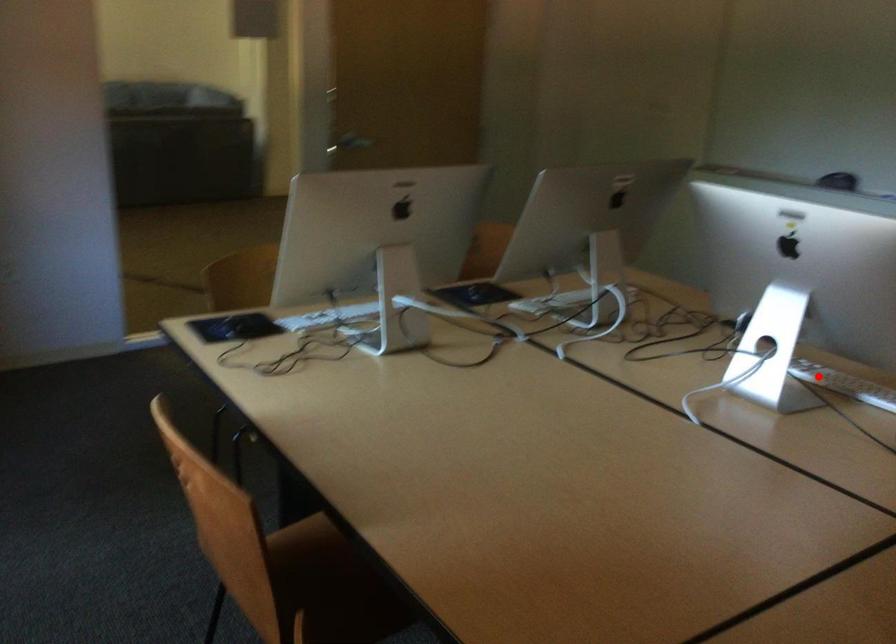
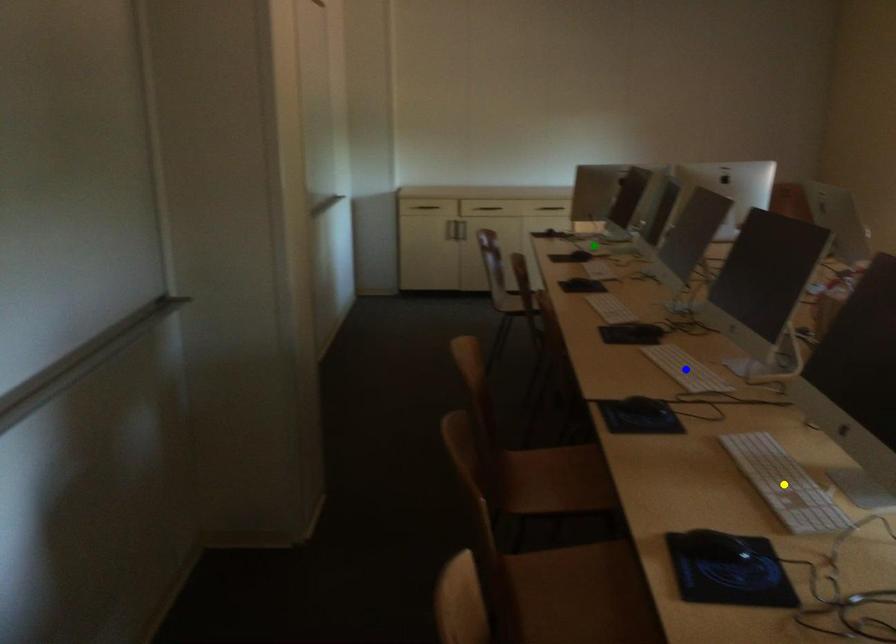
Question: I am providing you with two images of the same scene from different viewpoints. A red point is marked on the first image. You are given multiple points on the second image. Which point in image 2 represents the same 3d spot as the red point in image 1?

Choices:
 (A) yellow point
 (B) blue point
 (C) green point

Answer: (A)